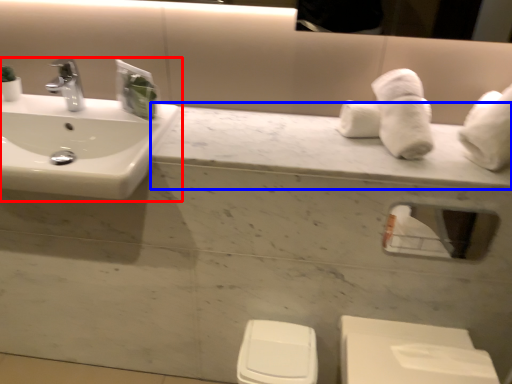
Question: Which object is further to the camera taking this photo, sink (highlighted by a red box) or counter top (highlighted by a blue box)?

Choices:
 (A) sink
 (B) counter top

Answer: (B)